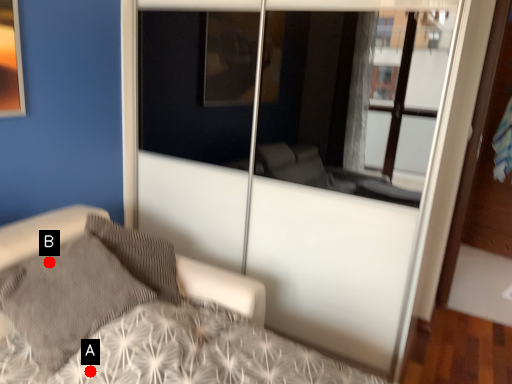
Question: Two points are circled on the image, labeled by A and B beside each circle. Which point is farther to the camera?

Choices:
 (A) A is further
 (B) B is further

Answer: (B)